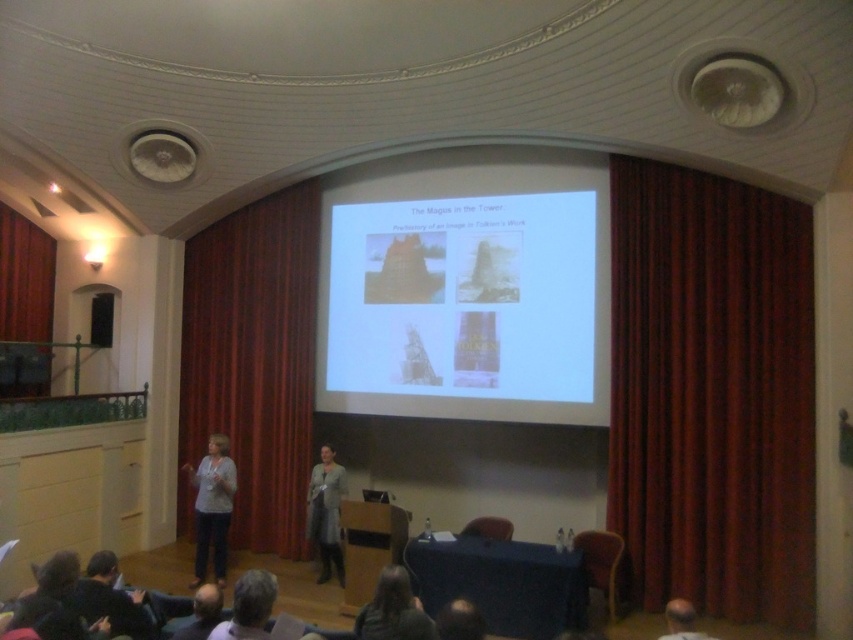
Who is taller, red velvet curtain at center or dark gray sweater at lower left?

red velvet curtain at center

How distant is red velvet curtain at center from dark gray sweater at lower left?

red velvet curtain at center and dark gray sweater at lower left are 4.10 meters apart from each other.

You are a GUI agent. You are given a task and a screenshot of the screen. Output one action in this format:
    pyautogui.click(x=<x>, y=<y>)
    Task: Click on the red velvet curtain at center
    The height and width of the screenshot is (640, 853).
    Given the screenshot: What is the action you would take?
    pyautogui.click(x=254, y=358)

Does red velvet curtain at center appear under smooth bald head at lower left?

No.

Does red velvet curtain at center have a greater width compared to smooth bald head at lower left?

Yes, red velvet curtain at center is wider than smooth bald head at lower left.

This screenshot has width=853, height=640. I want to click on red velvet curtain at center, so click(x=254, y=358).

Find the location of a particular element. Image resolution: width=853 pixels, height=640 pixels. white paper at center is located at coordinates (463, 296).

Does white paper at center appear on the left side of red velvet curtain at center?

In fact, white paper at center is to the right of red velvet curtain at center.

Is point (415, 298) more distant than point (219, 276)?

No, it is in front of (219, 276).

The image size is (853, 640). I want to click on white paper at center, so pyautogui.click(x=463, y=296).